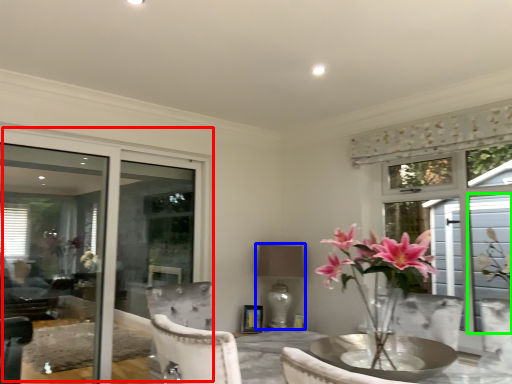
Question: Considering the real-world distances, which object is closest to window (highlighted by a red box)? lamp (highlighted by a blue box) or window screen (highlighted by a green box).

Choices:
 (A) lamp
 (B) window screen

Answer: (A)